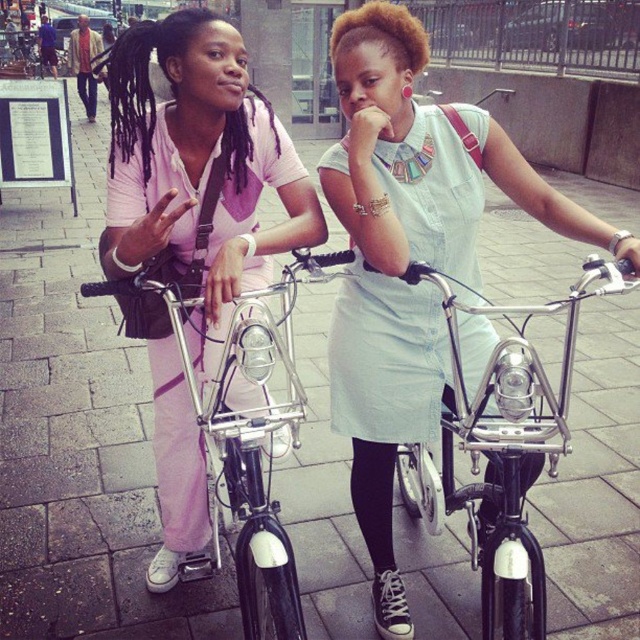
Is light blue dress at center wider than matte pink pants at left?

Correct, the width of light blue dress at center exceeds that of matte pink pants at left.

Is light blue dress at center in front of matte pink pants at left?

No, light blue dress at center is further to the viewer.

Between point (392, 376) and point (221, 186), which one is positioned in front?

Point (221, 186)

The image size is (640, 640). Find the location of `light blue dress at center`. light blue dress at center is located at coordinates (410, 257).

Is point (406, 93) behind point (492, 362)?

Yes, it is.

Can you confirm if light blue dress at center is wider than shiny chrome bicycle at center?

Yes.

At what (x,y) coordinates should I click in order to perform the action: click on light blue dress at center. Please return your answer as a coordinate pair (x, y). This screenshot has width=640, height=640. Looking at the image, I should click on (410, 257).

The image size is (640, 640). Find the location of `light blue dress at center`. light blue dress at center is located at coordinates (410, 257).

Does light blue dress at center have a lesser height compared to brushed metal bicycle at left?

In fact, light blue dress at center may be taller than brushed metal bicycle at left.

Identify the location of light blue dress at center. (410, 257).